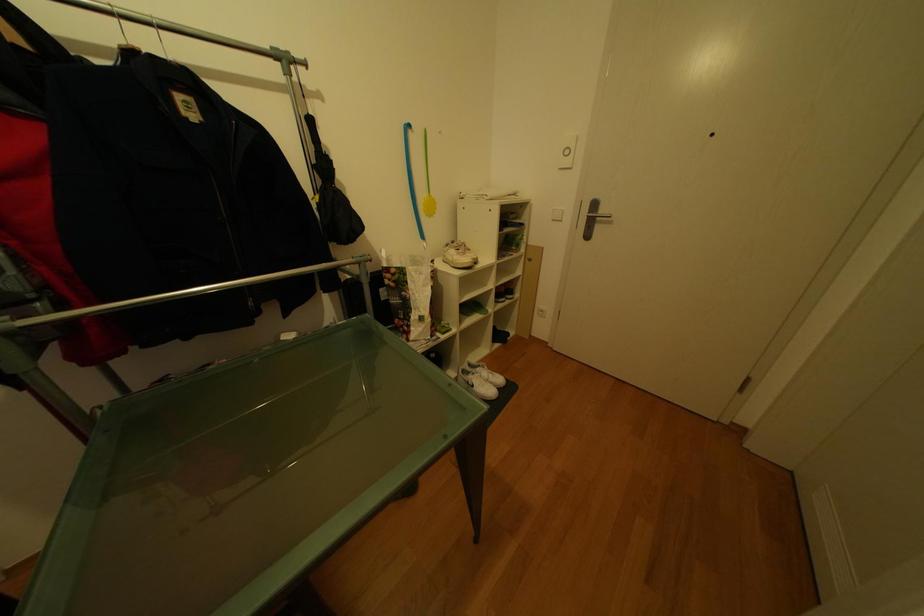
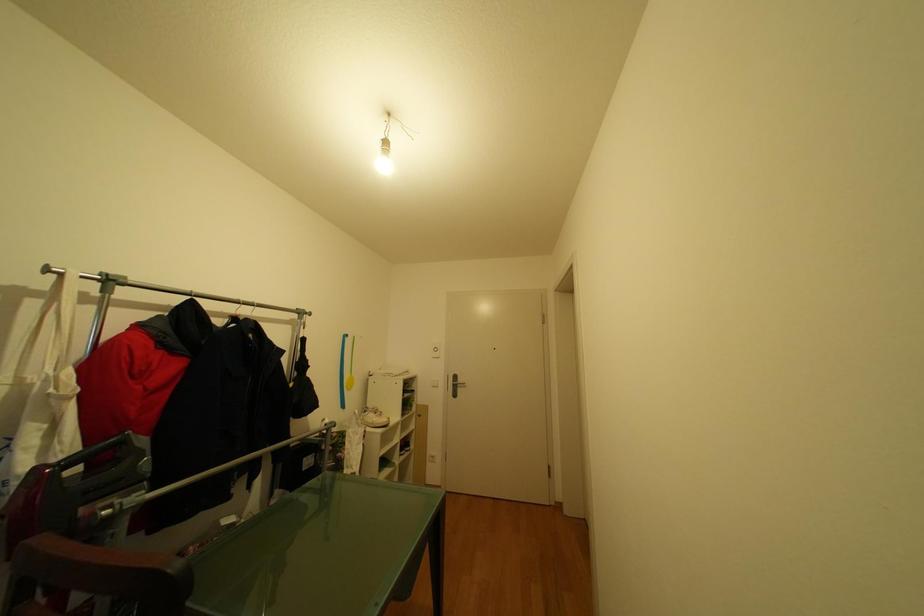
The images are taken continuously from a first-person perspective. In which direction is your viewpoint rotating?

The rotation direction of the camera is right-up.